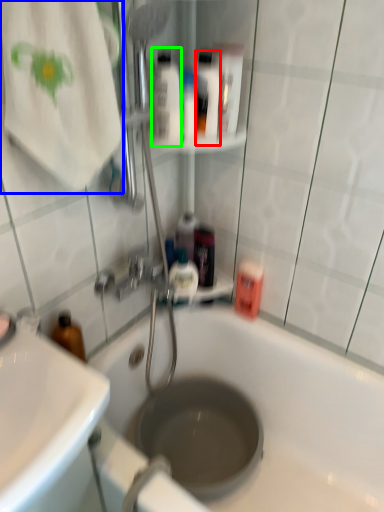
Question: Which is farther away from mouthwash (highlighted by a red box)? beach towel (highlighted by a blue box) or mouthwash (highlighted by a green box)?

Choices:
 (A) beach towel
 (B) mouthwash

Answer: (A)